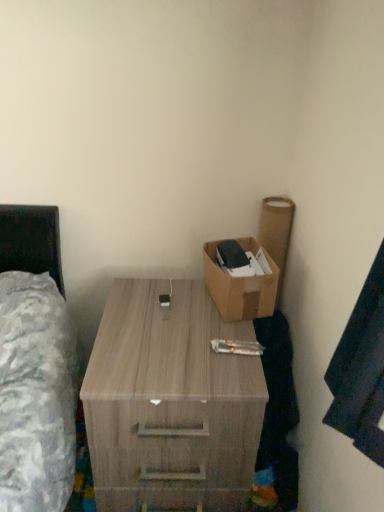
Find the location of `wooden desk at center`. wooden desk at center is located at coordinates (170, 402).

Describe the element at coordinates (170, 402) in the screenshot. I see `wooden desk at center` at that location.

What are the coordinates of `brown cardboard box at upper right` in the screenshot? It's located at click(x=239, y=289).

What do you see at coordinates (239, 289) in the screenshot?
I see `brown cardboard box at upper right` at bounding box center [239, 289].

This screenshot has width=384, height=512. Find the location of `wooden desk at center`. wooden desk at center is located at coordinates tap(170, 402).

Between brown cardboard box at upper right and wooden desk at center, which one appears on the left side from the viewer's perspective?

Positioned to the left is wooden desk at center.

Which object is closer to the camera, brown cardboard box at upper right or wooden desk at center?

wooden desk at center is closer to the camera.

Which is closer, (258,302) or (176,453)?

The point (176,453) is closer to the camera.

From the picture: From the image's perspective, is brown cardboard box at upper right under wooden desk at center?

No, from the image's perspective, brown cardboard box at upper right is not below wooden desk at center.

From a real-world perspective, is brown cardboard box at upper right physically located above or below wooden desk at center?

From a real-world perspective, brown cardboard box at upper right is physically above wooden desk at center.

Considering the sizes of objects brown cardboard box at upper right and wooden desk at center in the image provided, who is thinner, brown cardboard box at upper right or wooden desk at center?

brown cardboard box at upper right is thinner.

Considering the relative sizes of brown cardboard box at upper right and wooden desk at center in the image provided, is brown cardboard box at upper right taller than wooden desk at center?

No, brown cardboard box at upper right is not taller than wooden desk at center.

Can you confirm if brown cardboard box at upper right is bigger than wooden desk at center?

Actually, brown cardboard box at upper right might be smaller than wooden desk at center.

Is brown cardboard box at upper right surrounding wooden desk at center?

No, wooden desk at center is not a part of brown cardboard box at upper right.

Is brown cardboard box at upper right positioned far away from wooden desk at center?

brown cardboard box at upper right is near wooden desk at center, not far away.

Is brown cardboard box at upper right oriented towards wooden desk at center?

No, brown cardboard box at upper right is not facing towards wooden desk at center.

Locate an element on the screen. desk to the left of brown cardboard box at upper right is located at coordinates (170, 402).

Visually, is wooden desk at center positioned to the left or to the right of brown cardboard box at upper right?

Based on their positions, wooden desk at center is located to the left of brown cardboard box at upper right.

Is wooden desk at center further to the viewer compared to brown cardboard box at upper right?

No, wooden desk at center is in front of brown cardboard box at upper right.

Is point (163, 313) closer to viewer compared to point (233, 321)?

No.

From the image's perspective, which is above, wooden desk at center or brown cardboard box at upper right?

brown cardboard box at upper right appears higher in the image.

From a real-world perspective, who is located lower, wooden desk at center or brown cardboard box at upper right?

wooden desk at center, from a real-world perspective.

Which object is thinner, wooden desk at center or brown cardboard box at upper right?

With smaller width is brown cardboard box at upper right.

Considering the sizes of wooden desk at center and brown cardboard box at upper right in the image, is wooden desk at center taller or shorter than brown cardboard box at upper right?

In the image, wooden desk at center appears to be taller than brown cardboard box at upper right.

Considering the sizes of objects wooden desk at center and brown cardboard box at upper right in the image provided, who is bigger, wooden desk at center or brown cardboard box at upper right?

Bigger between the two is wooden desk at center.

Can we say wooden desk at center lies outside brown cardboard box at upper right?

That's correct, wooden desk at center is outside of brown cardboard box at upper right.

Is wooden desk at center not close to brown cardboard box at upper right?

No.

Is wooden desk at center oriented towards brown cardboard box at upper right?

Result: No, wooden desk at center does not turn towards brown cardboard box at upper right.

How much distance is there between wooden desk at center and brown cardboard box at upper right?

wooden desk at center is 11.03 inches away from brown cardboard box at upper right.

The image size is (384, 512). I want to click on desk in front of the brown cardboard box at upper right, so click(170, 402).

Locate an element on the screen. The image size is (384, 512). desk located underneath the brown cardboard box at upper right (from a real-world perspective) is located at coordinates (170, 402).

The image size is (384, 512). In order to click on desk in front of the brown cardboard box at upper right in this screenshot , I will do `click(170, 402)`.